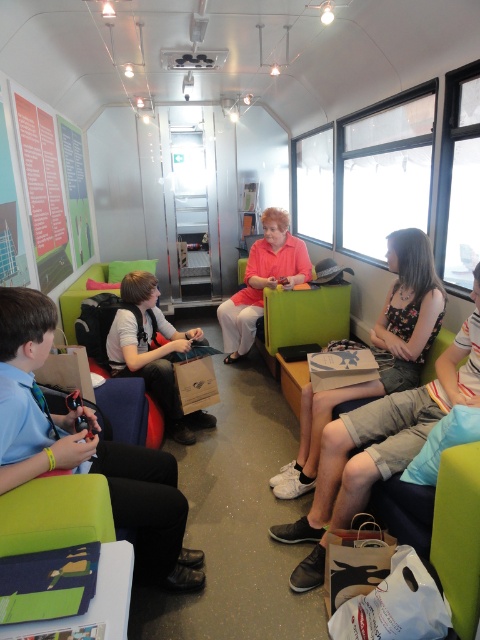
Question: Which point appears farthest from the camera in this image?

Choices:
 (A) (389, 340)
 (B) (50, 216)

Answer: (B)

Question: Which point appears farthest from the camera in this image?

Choices:
 (A) (147, 500)
 (B) (424, 292)
 (C) (308, 266)
 (D) (146, 356)

Answer: (C)

Question: Is light blue shirt at left below matte brown paper bag at center?

Choices:
 (A) no
 (B) yes

Answer: (B)

Question: Which point appears closest to the camera in this image?

Choices:
 (A) tap(54, 240)
 (B) tap(148, 556)
 (C) tap(373, 342)
 (D) tap(288, 284)

Answer: (B)

Question: Does light blue shirt at left have a larger size compared to matte brown paper bag at center?

Choices:
 (A) no
 (B) yes

Answer: (B)

Question: Does floral fabric dress at center lie in front of matte orange shirt at center?

Choices:
 (A) yes
 (B) no

Answer: (A)